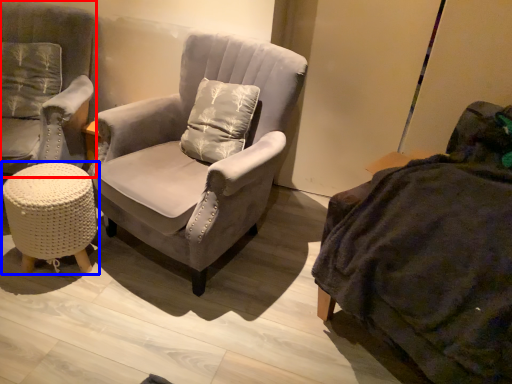
Question: Which point is closer to the camera, chair (highlighted by a red box) or table (highlighted by a blue box)?

Choices:
 (A) chair
 (B) table

Answer: (A)